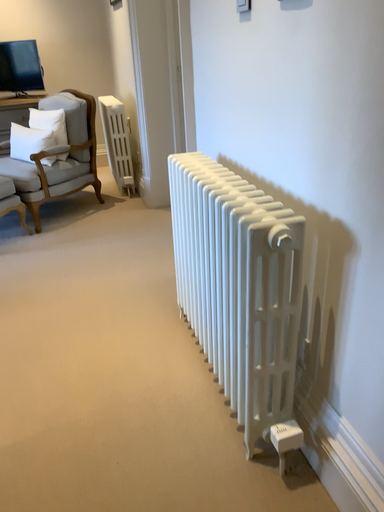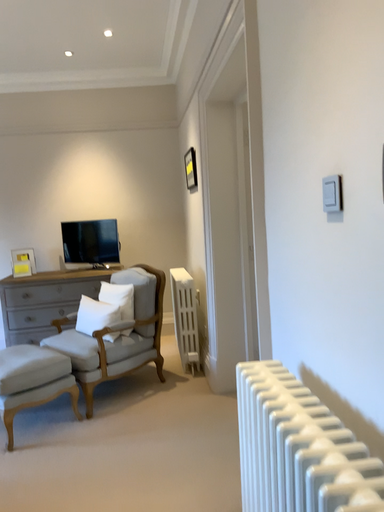
Question: Which way did the camera rotate in the video?

Choices:
 (A) rotated right
 (B) rotated left

Answer: (B)